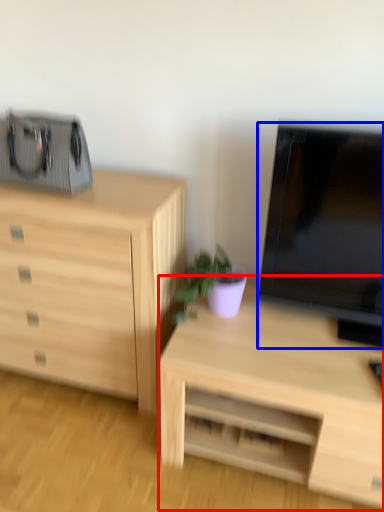
Question: Which point is closer to the camera, desk (highlighted by a red box) or television (highlighted by a blue box)?

Choices:
 (A) desk
 (B) television

Answer: (B)